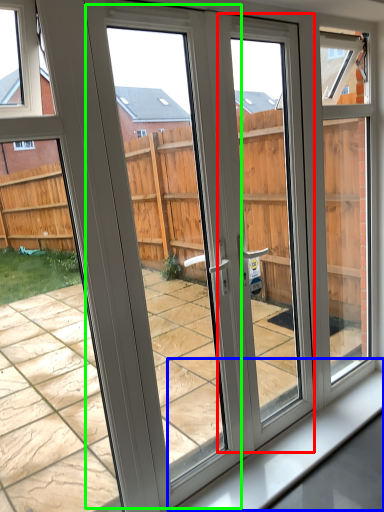
Question: Based on their relative distances, which object is nearer to screen door (highlighted by a red box)? Choose from window sill (highlighted by a blue box) and screen door (highlighted by a green box).

Choices:
 (A) window sill
 (B) screen door

Answer: (B)